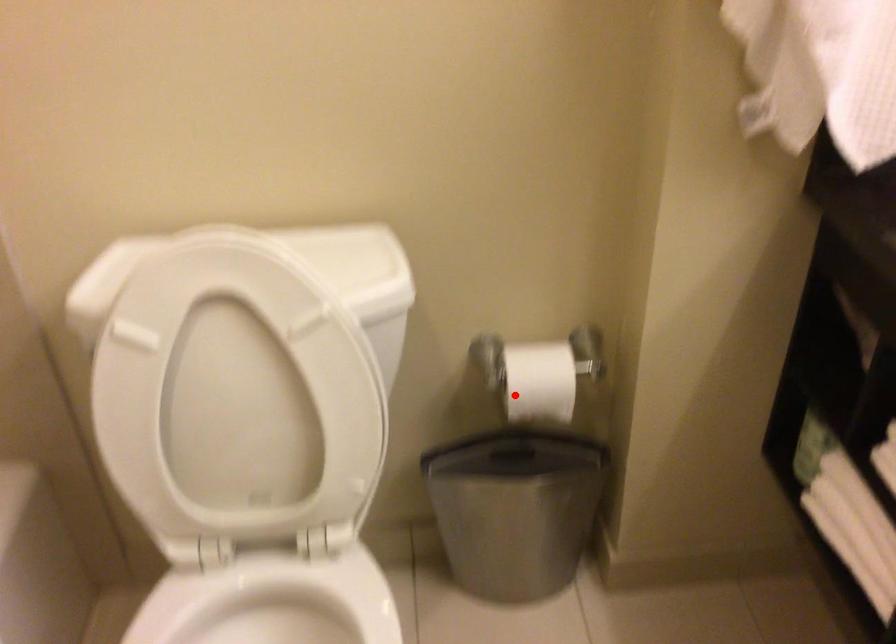
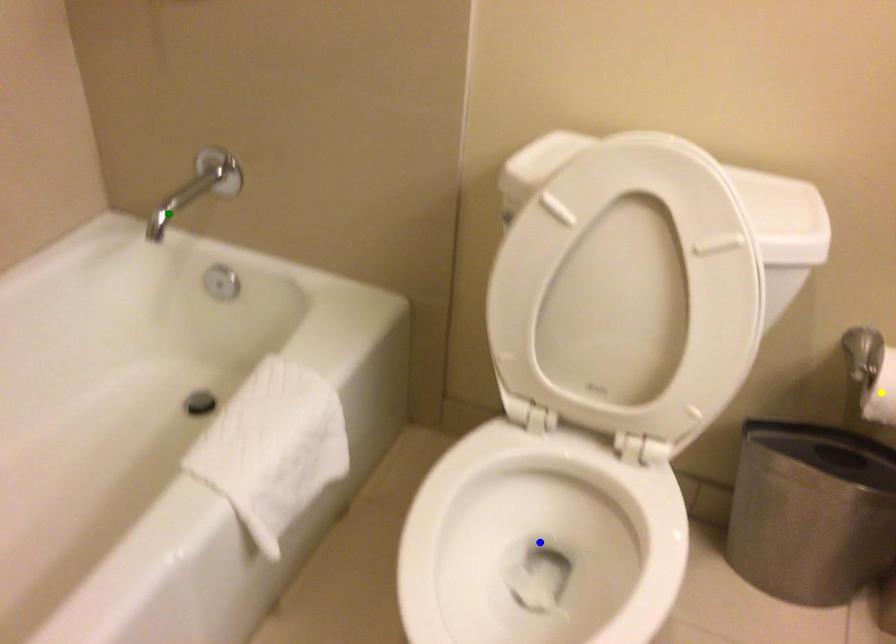
Question: I am providing you with two images of the same scene from different viewpoints. A red point is marked on the first image. You are given multiple points on the second image. Which spot in image 2 lines up with the point in image 1?

Choices:
 (A) green point
 (B) yellow point
 (C) blue point

Answer: (B)